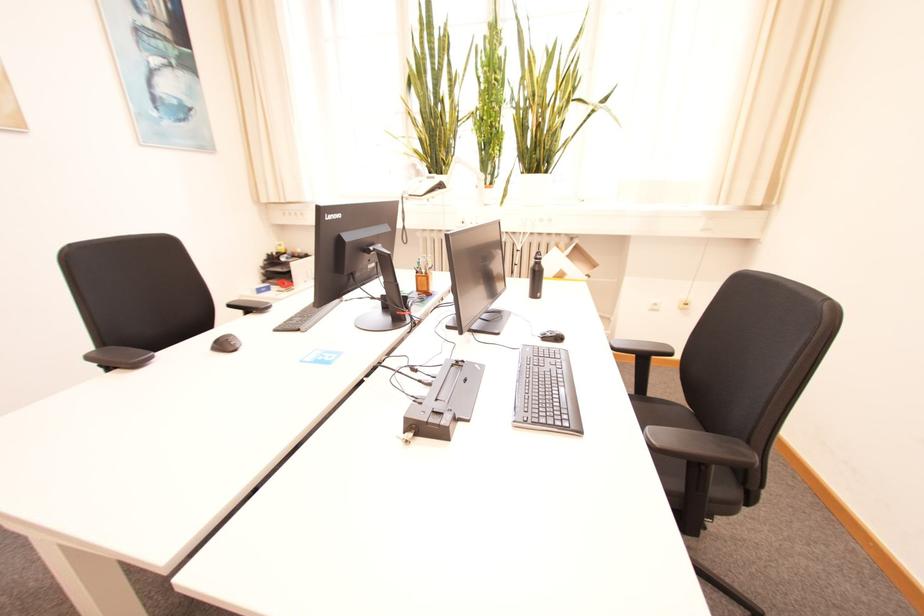
Find the location of a particular element. The width and height of the screenshot is (924, 616). black bottle cap is located at coordinates (225, 342).